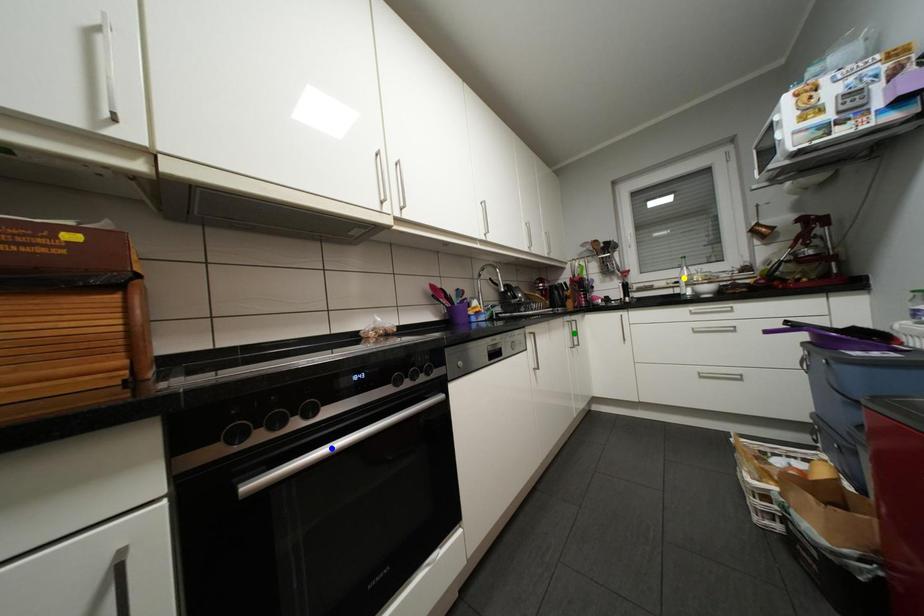
Order these from nearest to farthest:
A) green point
B) yellow point
C) blue point

blue point → green point → yellow point